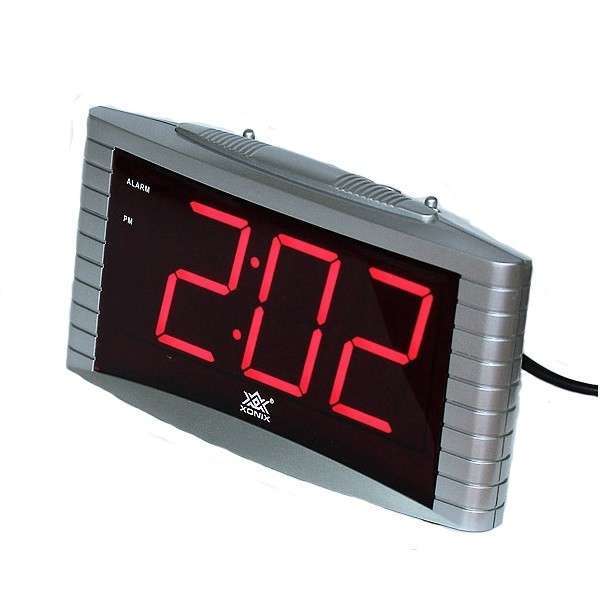
The height and width of the screenshot is (600, 600). Find the location of `1 alarm clock`. 1 alarm clock is located at coordinates (459, 383).